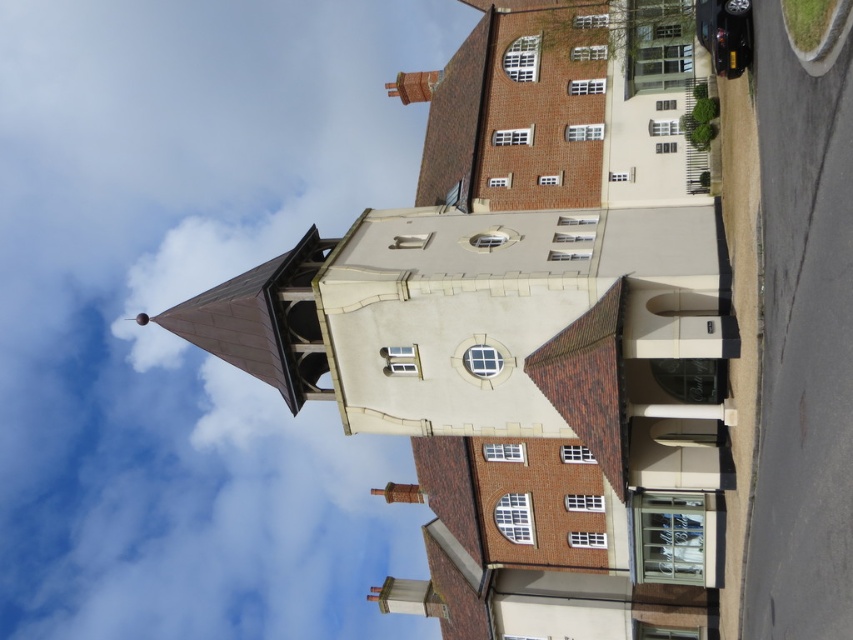
Can you confirm if brown tiled tower at center is shorter than metallic silver clock at center?

No.

Is point (412, 429) farther from viewer compared to point (738, 12)?

That is True.

Locate an element on the screen. The width and height of the screenshot is (853, 640). brown tiled tower at center is located at coordinates (527, 333).